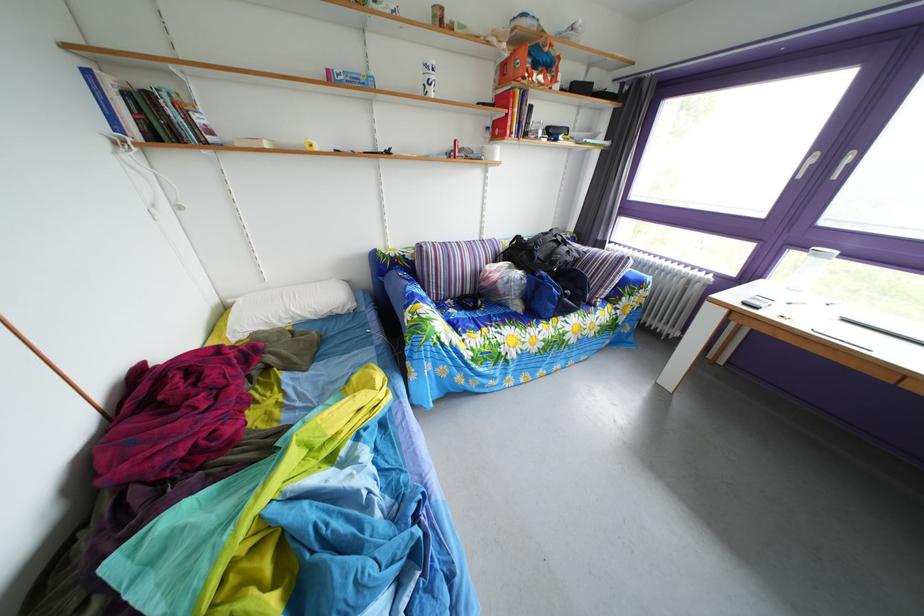
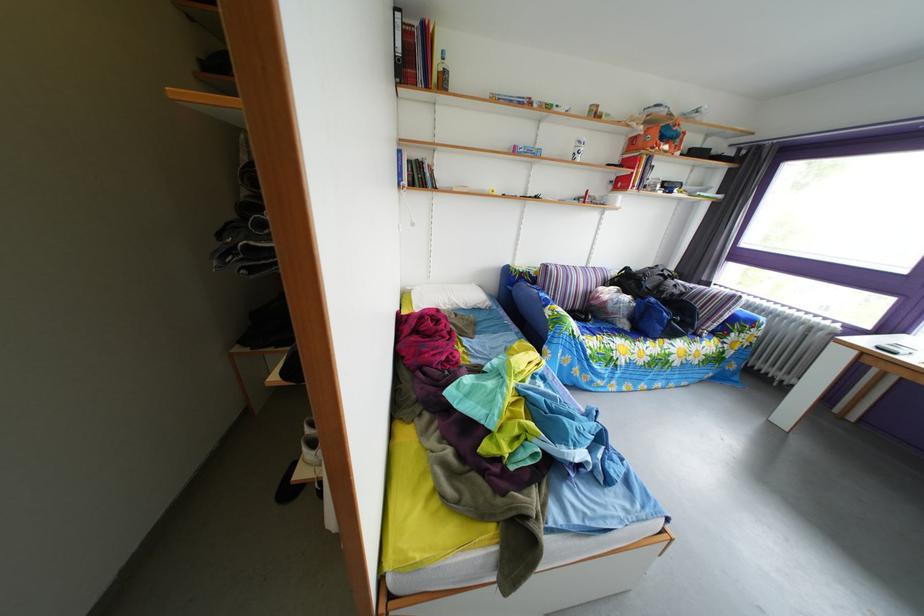
Find the pixel in the second image that matches [492,241] in the first image.

(599, 270)